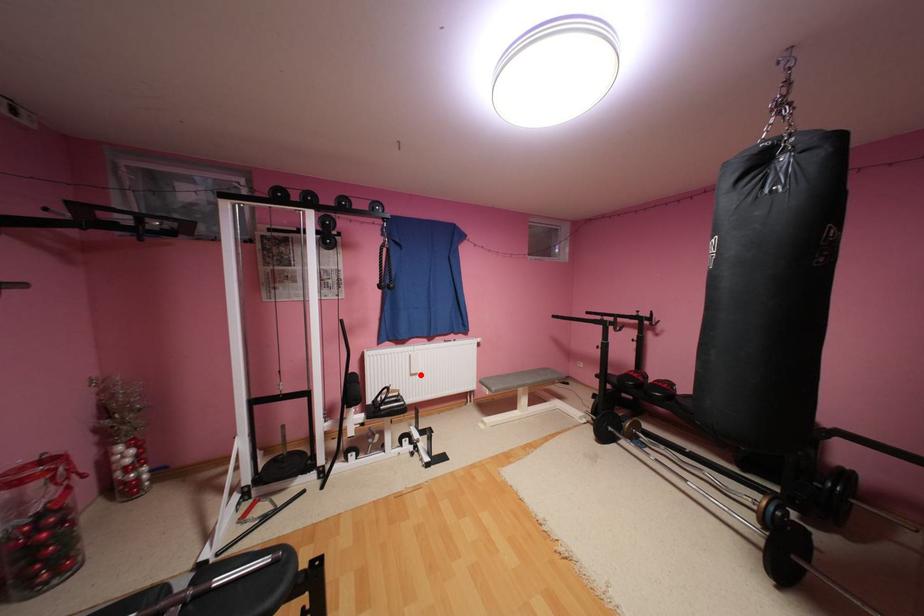
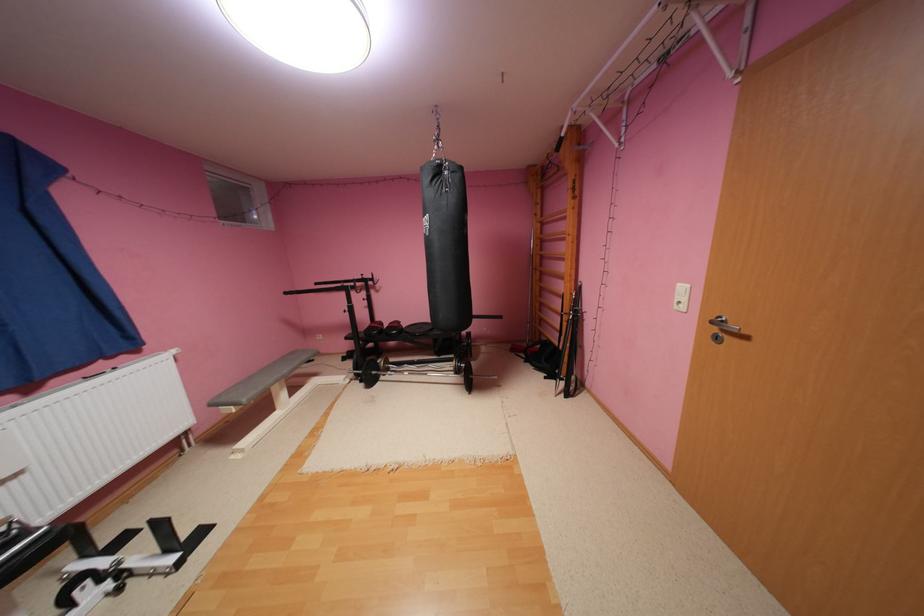
Question: I am providing you with two images of the same scene from different viewpoints. In image1, a red point is highlighted. Considering the same 3D point in image2, which of the following is correct?

Choices:
 (A) It is closer
 (B) It is farther

Answer: (B)